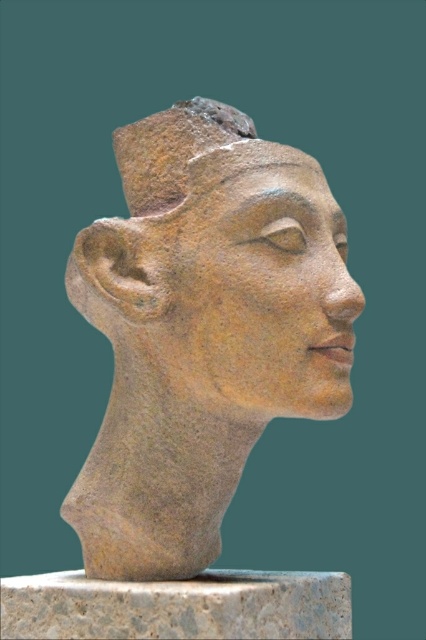
Is earthenware statue at center below granite pedestal at center?

No, earthenware statue at center is not below granite pedestal at center.

This screenshot has width=426, height=640. What do you see at coordinates (221, 269) in the screenshot?
I see `earthenware statue at center` at bounding box center [221, 269].

You are a GUI agent. You are given a task and a screenshot of the screen. Output one action in this format:
    pyautogui.click(x=<x>, y=<y>)
    Task: Click on the earthenware statue at center
    The image size is (426, 640).
    Given the screenshot: What is the action you would take?
    pyautogui.click(x=221, y=269)